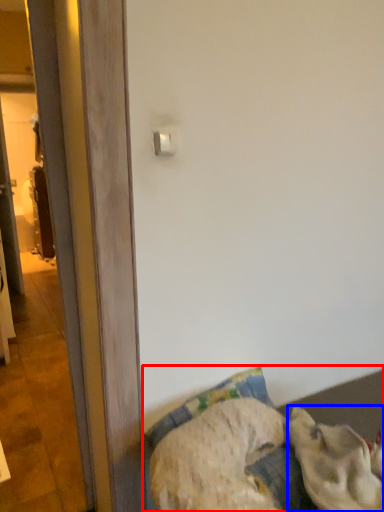
Question: Which object is further to the camera taking this photo, furniture (highlighted by a red box) or animal (highlighted by a blue box)?

Choices:
 (A) furniture
 (B) animal

Answer: (B)